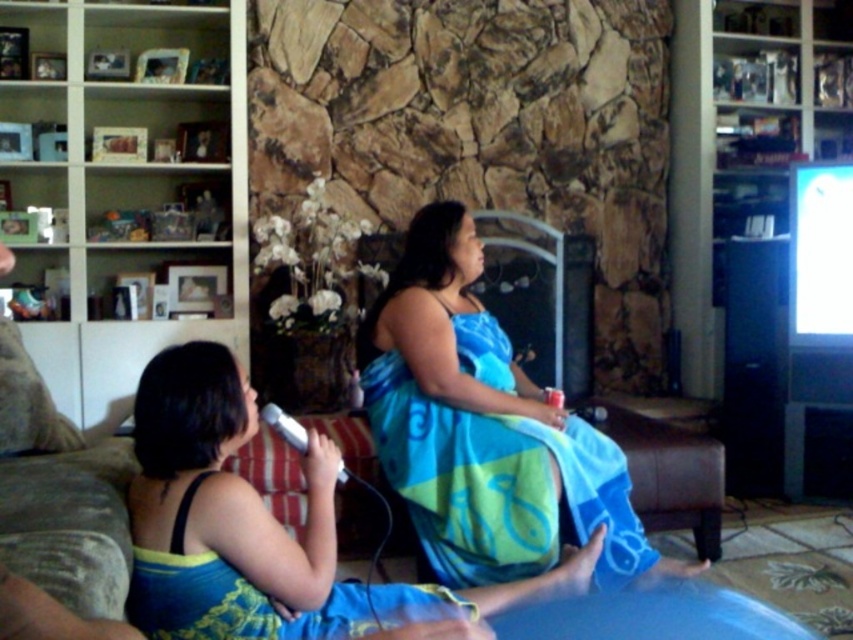
Question: Can you confirm if blue cotton dress at center is wider than white plastic microphone at center?

Choices:
 (A) yes
 (B) no

Answer: (A)

Question: Estimate the real-world distances between objects in this image. Which object is farther from the white plastic microphone at center?

Choices:
 (A) blue cotton dress at center
 (B) blue fabric dress at center
 (C) velvet brown couch at lower left

Answer: (B)

Question: Which object is positioned closest to the blue fabric dress at center?

Choices:
 (A) velvet brown couch at lower left
 (B) blue cotton dress at center

Answer: (B)

Question: Does velvet brown couch at lower left lie in front of white plastic microphone at center?

Choices:
 (A) yes
 (B) no

Answer: (A)

Question: Which object is positioned closest to the blue cotton dress at center?

Choices:
 (A) blue fabric dress at center
 (B) white plastic microphone at center
 (C) velvet brown couch at lower left

Answer: (B)

Question: Can you confirm if blue fabric dress at center is positioned above white plastic microphone at center?

Choices:
 (A) no
 (B) yes

Answer: (A)